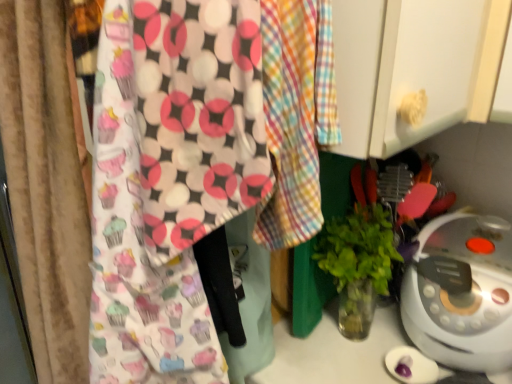
Question: Can you confirm if cupcake-patterned fabric at center is shorter than white plastic rice cooker at lower right?

Choices:
 (A) no
 (B) yes

Answer: (A)

Question: From the image's perspective, is cupcake-patterned fabric at center beneath white plastic rice cooker at lower right?

Choices:
 (A) yes
 (B) no

Answer: (B)

Question: Is cupcake-patterned fabric at center aimed at white plastic rice cooker at lower right?

Choices:
 (A) yes
 (B) no

Answer: (B)

Question: Is cupcake-patterned fabric at center taller than white plastic rice cooker at lower right?

Choices:
 (A) yes
 (B) no

Answer: (A)

Question: Is white plastic rice cooker at lower right at the back of cupcake-patterned fabric at center?

Choices:
 (A) no
 (B) yes

Answer: (B)

Question: From the image's perspective, is green leafy plant in clear glass vase at center-right above or below white plastic rice cooker at lower right?

Choices:
 (A) below
 (B) above

Answer: (B)

Question: Considering the positions of point (337, 254) and point (501, 284), is point (337, 254) closer or farther from the camera than point (501, 284)?

Choices:
 (A) farther
 (B) closer

Answer: (A)

Question: Is green leafy plant in clear glass vase at center-right to the left or to the right of white plastic rice cooker at lower right in the image?

Choices:
 (A) left
 (B) right

Answer: (A)

Question: Considering the positions of green leafy plant in clear glass vase at center-right and white plastic rice cooker at lower right in the image, is green leafy plant in clear glass vase at center-right taller or shorter than white plastic rice cooker at lower right?

Choices:
 (A) tall
 (B) short

Answer: (A)

Question: Is point (340, 278) positioned closer to the camera than point (244, 49)?

Choices:
 (A) closer
 (B) farther

Answer: (B)

Question: Would you say green leafy plant in clear glass vase at center-right is to the left or to the right of cupcake-patterned fabric at center in the picture?

Choices:
 (A) left
 (B) right

Answer: (B)

Question: From the image's perspective, is green leafy plant in clear glass vase at center-right above or below cupcake-patterned fabric at center?

Choices:
 (A) above
 (B) below

Answer: (B)

Question: Is green leafy plant in clear glass vase at center-right taller or shorter than cupcake-patterned fabric at center?

Choices:
 (A) short
 (B) tall

Answer: (A)

Question: Relative to green leafy plant in clear glass vase at center-right, is white plastic rice cooker at lower right in front or behind?

Choices:
 (A) behind
 (B) front

Answer: (B)

Question: In terms of width, does white plastic rice cooker at lower right look wider or thinner when compared to green leafy plant in clear glass vase at center-right?

Choices:
 (A) thin
 (B) wide

Answer: (B)